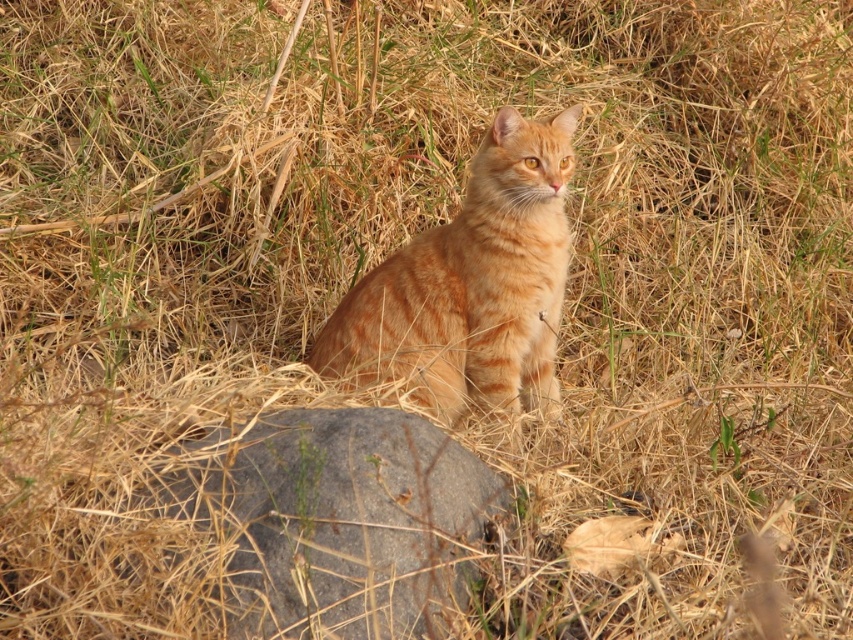
You are a photographer trying to capture the orange fur cat at center. You need to position yourself so that the gray rough stone at lower center is not blocking the cat. Which direction should you move relative to the cat?

You should move to the right relative to the orange fur cat at center because the gray rough stone at lower center is located to the left of the cat, so moving right would place the stone out of the frame or behind you.

You are a photographer trying to capture the orange fur cat at center. You notice the gray rough stone at lower center in the frame. Is the stone blocking the cat from your view?

The gray rough stone at lower center is positioned under the orange fur cat at center, so it might partially block the cat from your view depending on the camera angle and distance.

You need to place a small toy between the gray rough stone at lower center and the orange fur cat at center. Based on their sizes, which object should the toy be closer to?

The gray rough stone at lower center might be wider than orange fur cat at center, so the toy should be placed closer to the orange fur cat at center to ensure there is enough space between them.